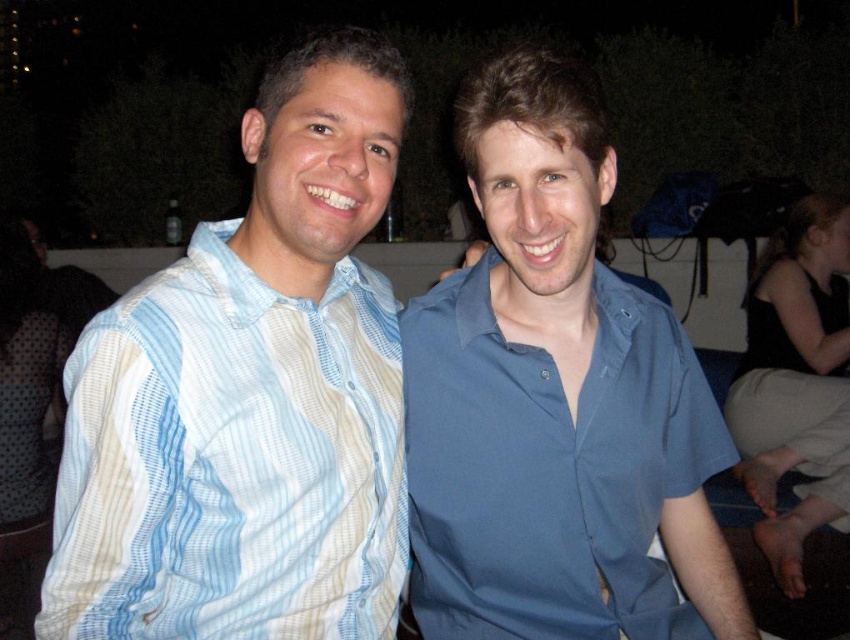
Question: Among these points, which one is nearest to the camera?

Choices:
 (A) (506, 282)
 (B) (782, 250)

Answer: (A)

Question: Which point is farther from the camera taking this photo?

Choices:
 (A) (763, 324)
 (B) (554, 116)
 (C) (238, 552)

Answer: (A)

Question: Among these points, which one is farthest from the camera?

Choices:
 (A) (766, 428)
 (B) (71, 381)

Answer: (A)

Question: Is blue cotton shirt at center thinner than black fabric at lower right?

Choices:
 (A) yes
 (B) no

Answer: (A)

Question: Does blue cotton shirt at center appear on the right side of black fabric at lower right?

Choices:
 (A) yes
 (B) no

Answer: (B)

Question: Is blue striped shirt at left further to camera compared to black fabric at lower right?

Choices:
 (A) no
 (B) yes

Answer: (A)